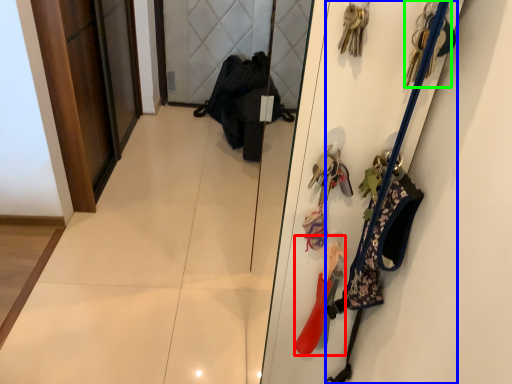
Question: Estimate the real-world distances between objects in this image. Which object is farther from accessory (highlighted by a red box), accessory (highlighted by a blue box) or accessory (highlighted by a green box)?

Choices:
 (A) accessory
 (B) accessory

Answer: (B)